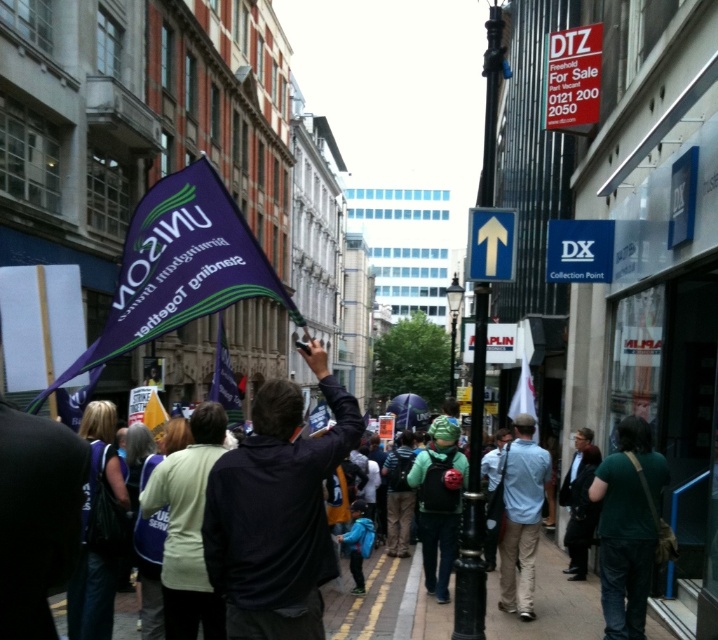
Question: Is dark blue jacket at center wider than green matte jacket at center?

Choices:
 (A) no
 (B) yes

Answer: (A)

Question: Can you confirm if dark blue jacket at center is positioned above green fabric shirt at lower right?

Choices:
 (A) yes
 (B) no

Answer: (A)

Question: Which point is farther to the camera?

Choices:
 (A) light blue shirt at center
 (B) green fabric jacket at center
 (C) black metal pole at center
 (D) green fabric shirt at lower right

Answer: (A)

Question: Observing the image, what is the correct spatial positioning of green fabric shirt at lower right in reference to light blue shirt at center?

Choices:
 (A) below
 (B) above

Answer: (B)

Question: Which object is closer to the camera taking this photo?

Choices:
 (A) black metal pole at center
 (B) green matte jacket at center

Answer: (A)

Question: Among these points, which one is farthest from the camera?

Choices:
 (A) (241, 634)
 (B) (162, 502)
 (C) (554, 634)

Answer: (C)